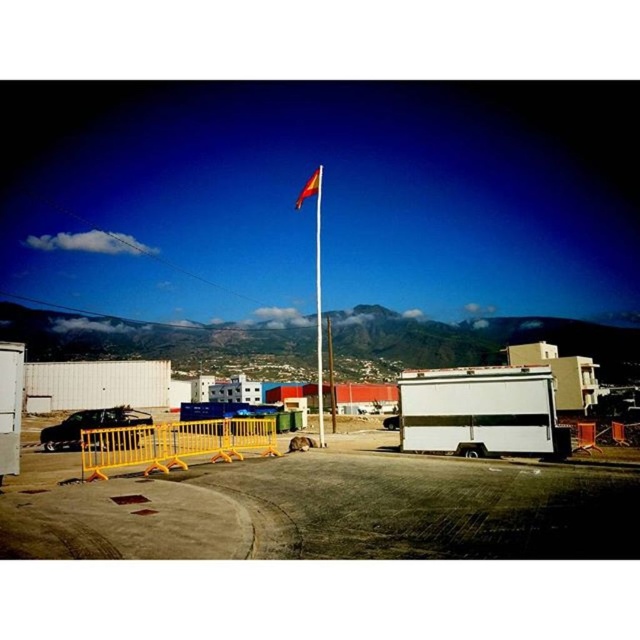
Image resolution: width=640 pixels, height=640 pixels. What do you see at coordinates (173, 444) in the screenshot?
I see `yellow plastic barricade at lower left` at bounding box center [173, 444].

Does yellow plastic barricade at lower left appear over metallic flag pole at center?

No.

Who is more forward, (152, 442) or (321, 432)?

Point (152, 442) is in front.

At what (x,y) coordinates should I click in order to perform the action: click on yellow plastic barricade at lower left. Please return your answer as a coordinate pair (x, y). Image resolution: width=640 pixels, height=640 pixels. Looking at the image, I should click on (173, 444).

Which is more to the right, metallic flag pole at center or red fabric flag at upper center?

red fabric flag at upper center

Can you confirm if metallic flag pole at center is bigger than red fabric flag at upper center?

Yes, metallic flag pole at center is bigger than red fabric flag at upper center.

This screenshot has height=640, width=640. Describe the element at coordinates (317, 292) in the screenshot. I see `metallic flag pole at center` at that location.

At what (x,y) coordinates should I click in order to perform the action: click on metallic flag pole at center. Please return your answer as a coordinate pair (x, y). Looking at the image, I should click on (317, 292).

Who is more distant from viewer, (90, 460) or (294, 205)?

The point (294, 205) is more distant.

Is point (268, 444) less distant than point (308, 182)?

Yes, point (268, 444) is in front of point (308, 182).

The width and height of the screenshot is (640, 640). Describe the element at coordinates (173, 444) in the screenshot. I see `yellow plastic barricade at lower left` at that location.

Where is `yellow plastic barricade at lower left`? yellow plastic barricade at lower left is located at coordinates (173, 444).